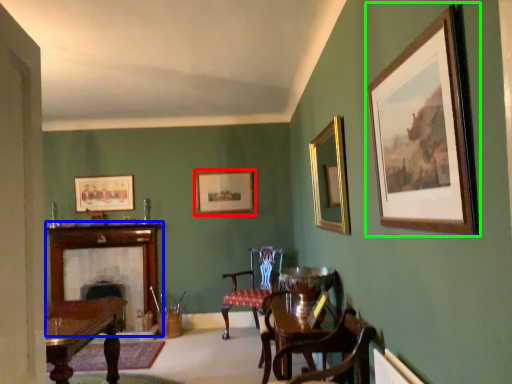
Question: Considering the real-world distances, which object is closest to picture frame (highlighted by a red box)? fireplace (highlighted by a blue box) or picture frame (highlighted by a green box).

Choices:
 (A) fireplace
 (B) picture frame

Answer: (A)